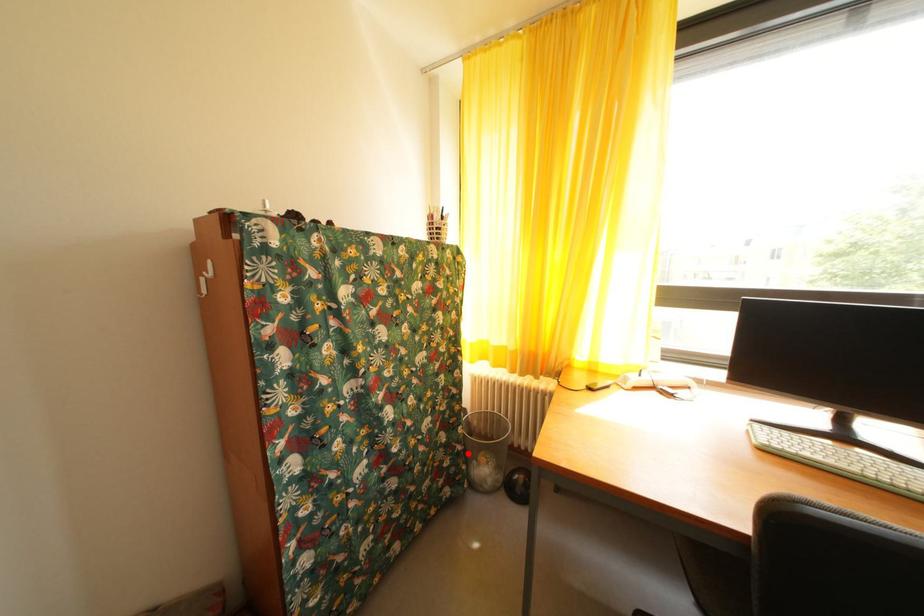
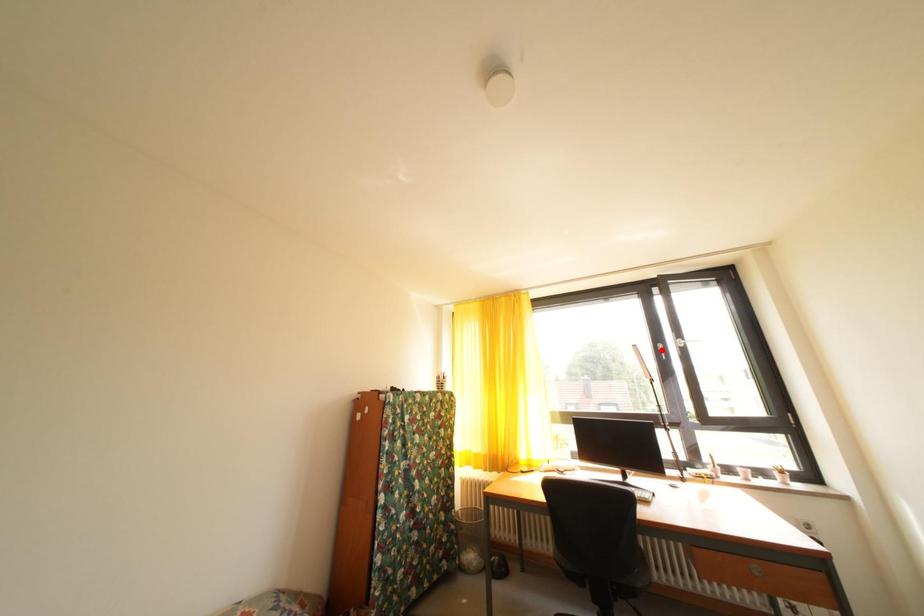
I am providing you with two images of the same scene from different viewpoints. A red point is marked on the first image and another point is marked on the second image. Is the red point in image1 aligned with the point shown in image2?

No